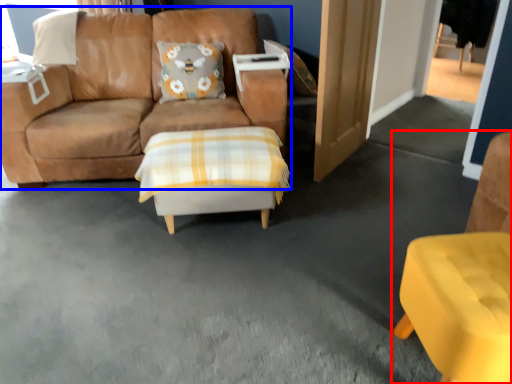
Question: Which of the following is the closest to the observer, chair (highlighted by a red box) or studio couch (highlighted by a blue box)?

Choices:
 (A) chair
 (B) studio couch

Answer: (A)